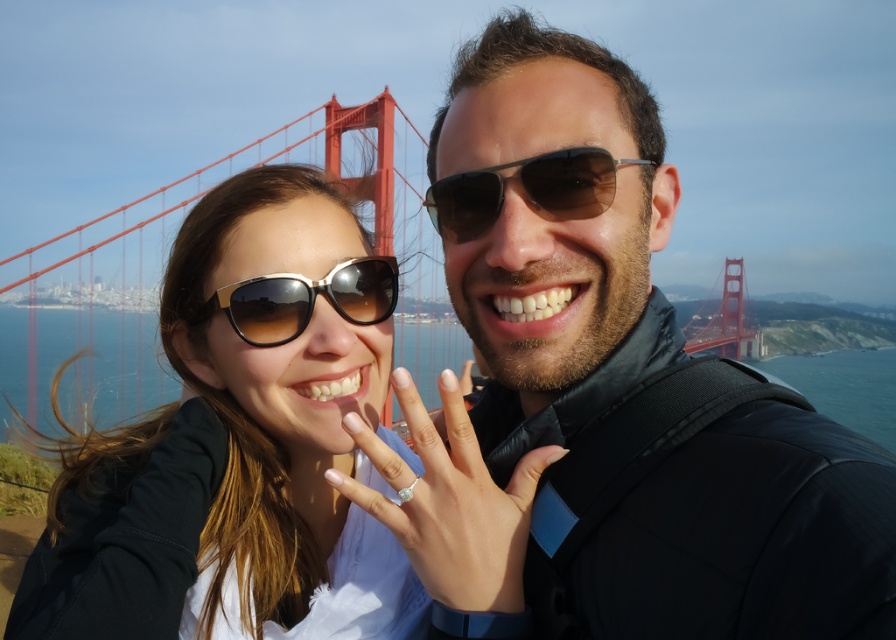
You are a photographer trying to adjust the lighting for a photo shoot. You notice two pairs of sunglasses in the scene. Which pair of sunglasses is positioned closer to the camera, the matte black sunglasses at upper center or the brown reflective sunglasses at center?

The matte black sunglasses at upper center is closer to the viewer than the brown reflective sunglasses at center, so the matte black sunglasses at upper center would be closer to the camera.

You are a photographer trying to capture the brown reflective sunglasses at center and the red painted steel bridge at center in a single shot. Based on their sizes, which object will appear smaller in the photo?

The brown reflective sunglasses at center will appear smaller in the photo because they are shorter than the red painted steel bridge at center.